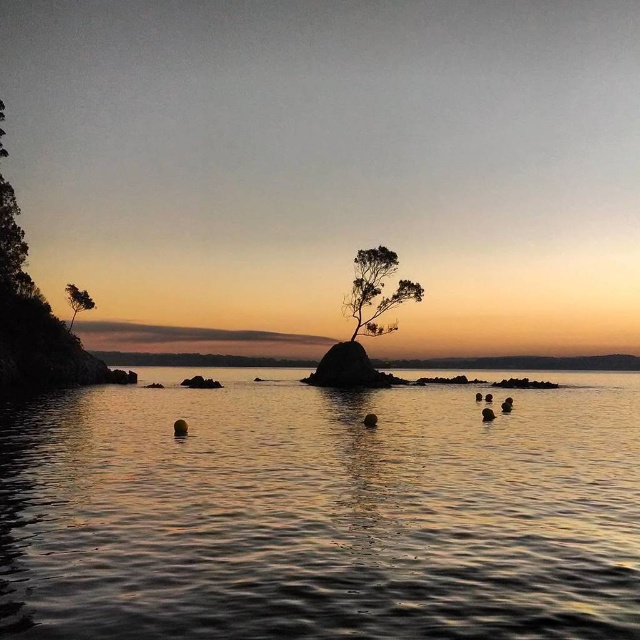
You are an observer standing on the shore looking at the sunset scene. Which object is positioned lower in the image, the glistening water at center or the green matte tree at left?

The glistening water at center is positioned below the green matte tree at left, so it is lower in the image.

You are an artist trying to paint the sunset scene. You want to ensure the sizes of the silhouette wood tree at center and the green matte tree at left are accurate. Which tree should you paint larger?

The silhouette wood tree at center should be painted larger since it is bigger than the green matte tree at left according to the description.

You are a photographer trying to capture the sunset reflection on the glistening water at center. Based on the coordinates provided, where should you position your camera to ensure the reflection is centered in your shot?

The glistening water at center is located at coordinates point (321,513), so positioning your camera directly facing that point will center the reflection in your shot.